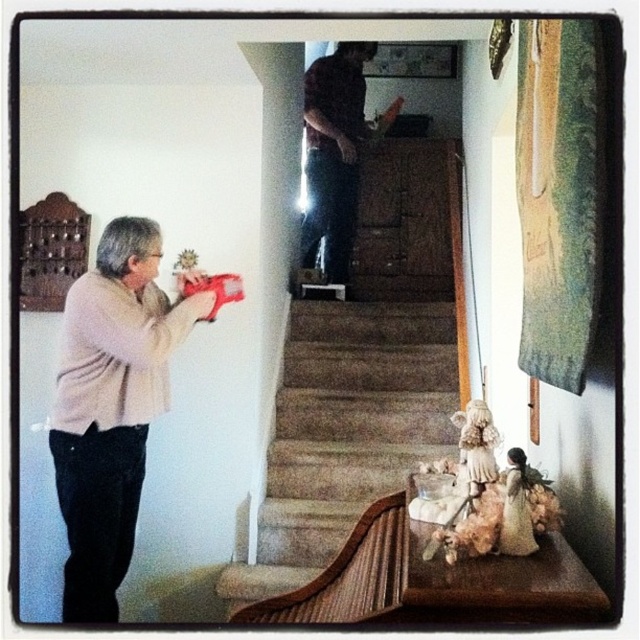
Can you confirm if beige sweater at left is bigger than dark brown shirt at upper center?

Yes, beige sweater at left is bigger than dark brown shirt at upper center.

In order to click on beige sweater at left in this screenshot , I will do `click(112, 406)`.

Does carpeted stairs at center have a larger size compared to beige sweater at left?

Indeed, carpeted stairs at center has a larger size compared to beige sweater at left.

Between carpeted stairs at center and beige sweater at left, which one appears on the right side from the viewer's perspective?

From the viewer's perspective, carpeted stairs at center appears more on the right side.

Is point (353, 461) positioned behind point (64, 502)?

Yes, point (353, 461) is farther from viewer.

You are a GUI agent. You are given a task and a screenshot of the screen. Output one action in this format:
    pyautogui.click(x=<x>, y=<y>)
    Task: Click on the carpeted stairs at center
    Image resolution: width=640 pixels, height=640 pixels.
    Given the screenshot: What is the action you would take?
    pyautogui.click(x=344, y=436)

Looking at this image, which is more to the left, carpeted stairs at center or dark brown shirt at upper center?

Positioned to the left is carpeted stairs at center.

In the scene shown: Between carpeted stairs at center and dark brown shirt at upper center, which one appears on the right side from the viewer's perspective?

dark brown shirt at upper center

Is point (428, 392) behind point (317, 72)?

No.

The height and width of the screenshot is (640, 640). Identify the location of carpeted stairs at center. (344, 436).